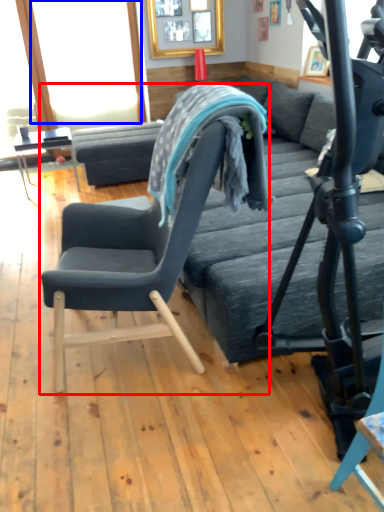
Question: Which object appears closest to the camera in this image, chair (highlighted by a red box) or window screen (highlighted by a blue box)?

Choices:
 (A) chair
 (B) window screen

Answer: (A)